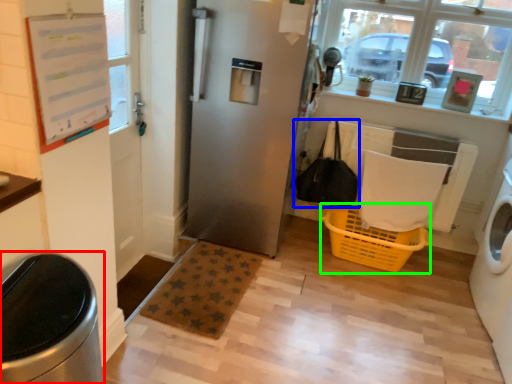
Question: Which object is positioned farthest from waste container (highlighted by a red box)? Select from bag (highlighted by a blue box) and basket (highlighted by a green box).

Choices:
 (A) bag
 (B) basket

Answer: (A)